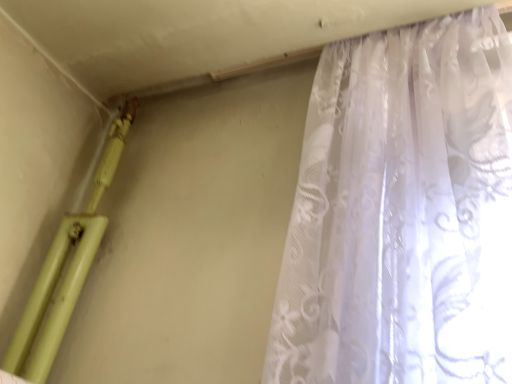
Describe the element at coordinates (402, 213) in the screenshot. I see `white sheer curtain at upper right` at that location.

This screenshot has height=384, width=512. Identify the location of white sheer curtain at upper right. (402, 213).

At what (x,y) coordinates should I click in order to perform the action: click on white sheer curtain at upper right. Please return your answer as a coordinate pair (x, y). The height and width of the screenshot is (384, 512). Looking at the image, I should click on (402, 213).